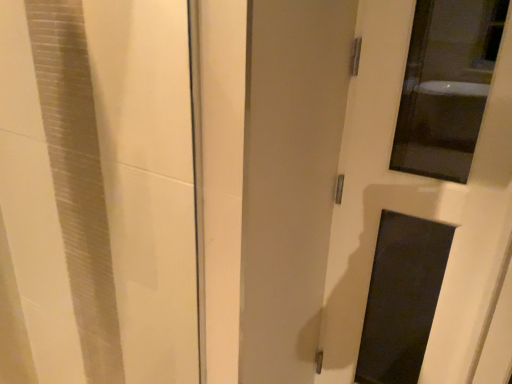
Locate an element on the screen. The height and width of the screenshot is (384, 512). white glossy door at right is located at coordinates (415, 203).

What do you see at coordinates (415, 203) in the screenshot? The width and height of the screenshot is (512, 384). I see `white glossy door at right` at bounding box center [415, 203].

Measure the distance between white glossy door at right and camera.

They are 36.44 inches apart.

The image size is (512, 384). I want to click on white glossy door at right, so click(415, 203).